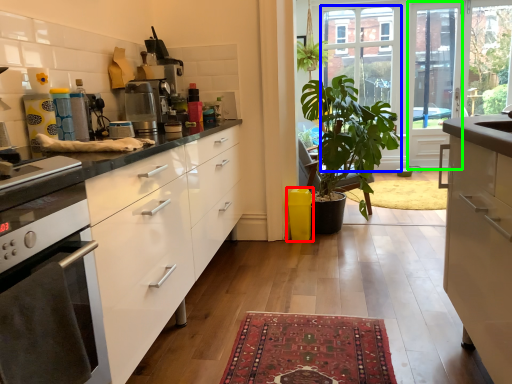
Question: Which is farther away from trash bin/can (highlighted by a red box)? glass door (highlighted by a blue box) or screen door (highlighted by a green box)?

Choices:
 (A) glass door
 (B) screen door

Answer: (B)